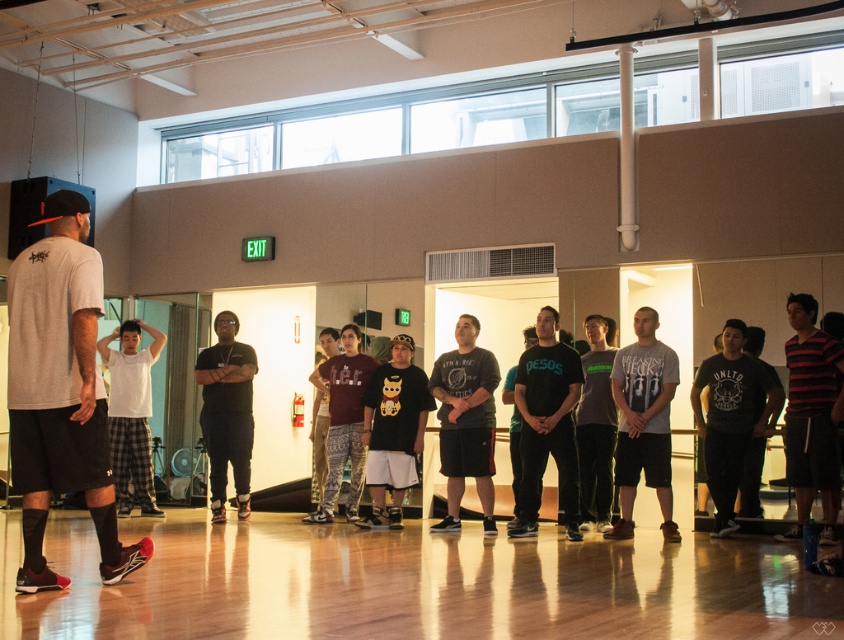
Question: Considering the real-world distances, which object is closest to the gray matte t-shirt at left?

Choices:
 (A) matte gray shirt at center
 (B) striped cotton shirt at right

Answer: (A)

Question: Can you confirm if striped cotton shirt at right is positioned to the left of matte black t-shirt at center?

Choices:
 (A) yes
 (B) no

Answer: (B)

Question: Does gray cotton t-shirt at center appear on the left side of black matte pants at center?

Choices:
 (A) no
 (B) yes

Answer: (A)

Question: Which point is closer to the camera taking this photo?

Choices:
 (A) (810, 298)
 (B) (577, 372)
 (C) (95, 509)

Answer: (C)

Question: Which point is farther from the camera taking this photo?

Choices:
 (A) (479, 449)
 (B) (109, 508)

Answer: (A)

Question: Does black matte t-shirt at center appear over matte black t-shirt at center?

Choices:
 (A) yes
 (B) no

Answer: (A)